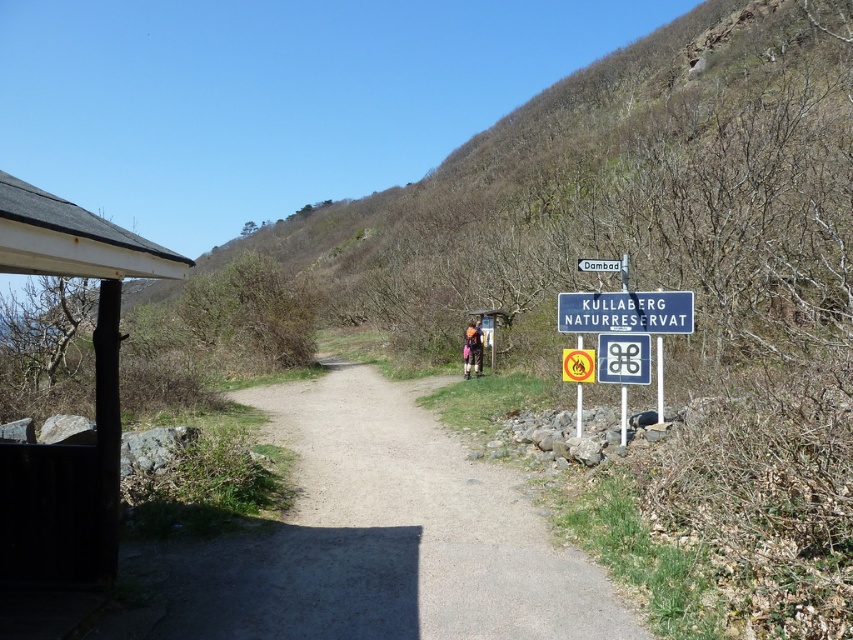
You are a hiker carrying both the brown fabric backpack at center and the brown leather backpack at center. You want to place them side by side on the ground so they don not touch each other. What is the minimum distance you should keep between them?

The minimum distance you should keep between the brown fabric backpack at center and the brown leather backpack at center is 4.49 centimeters to ensure they do not touch each other.

You are standing in the Kullaberg Nature Reserve and see a dirt path at center and a brown leather backpack at center. Which object is located to the left of the other?

The dirt path at center is to the left of brown leather backpack at center.

You are a hiker carrying both the brown fabric backpack at center and the brown leather backpack at center. You need to walk through a narrow tunnel that only allows backpacks up to 30 cm in width. Which backpack should you remove to ensure you can pass through?

The brown fabric backpack at center might be wider than the brown leather backpack at center. To ensure you can pass through the tunnel, you should remove the brown fabric backpack at center and carry only the brown leather backpack at center.